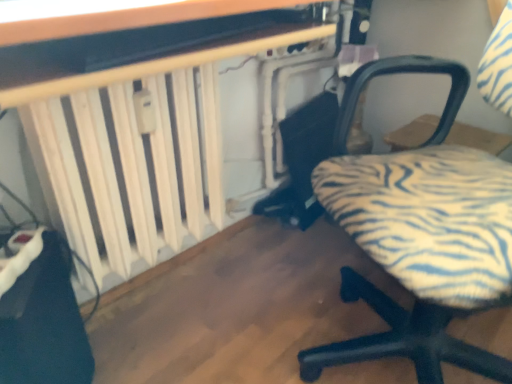
Question: Is zebra-patterned fabric chair at lower right at the left side of white wooden radiator at left, which is the first table in back-to-front order?

Choices:
 (A) no
 (B) yes

Answer: (A)

Question: Could you tell me if zebra-patterned fabric chair at lower right is turned towards white wooden radiator at left, which is the first table in back-to-front order?

Choices:
 (A) yes
 (B) no

Answer: (B)

Question: From a real-world perspective, is zebra-patterned fabric chair at lower right under white wooden radiator at left, which is the first table in back-to-front order?

Choices:
 (A) no
 (B) yes

Answer: (A)

Question: Is zebra-patterned fabric chair at lower right far away from white wooden radiator at left, which is the first table in back-to-front order?

Choices:
 (A) yes
 (B) no

Answer: (B)

Question: Considering the relative positions of zebra-patterned fabric chair at lower right and white wooden radiator at left, which is the first table in back-to-front order, in the image provided, is zebra-patterned fabric chair at lower right to the right of white wooden radiator at left, which is the first table in back-to-front order, from the viewer's perspective?

Choices:
 (A) yes
 (B) no

Answer: (A)

Question: Is white wooden radiator at left, which is the 2th table in front-to-back order, in front of or behind wooden table at upper center, which is the 2th table from back to front, in the image?

Choices:
 (A) behind
 (B) front

Answer: (A)

Question: Is white wooden radiator at left, which is the first table in back-to-front order, wider or thinner than wooden table at upper center, arranged as the first table when viewed from the front?

Choices:
 (A) thin
 (B) wide

Answer: (B)

Question: From a real-world perspective, is white wooden radiator at left, which is the first table in back-to-front order, above or below wooden table at upper center, arranged as the first table when viewed from the front?

Choices:
 (A) above
 (B) below

Answer: (B)

Question: Considering the positions of white wooden radiator at left, which is the first table in back-to-front order, and wooden table at upper center, which is the 2th table from back to front, in the image, is white wooden radiator at left, which is the first table in back-to-front order, taller or shorter than wooden table at upper center, which is the 2th table from back to front,?

Choices:
 (A) short
 (B) tall

Answer: (B)

Question: Would you say wooden table at upper center, arranged as the first table when viewed from the front, is inside or outside white wooden radiator at left, which is the first table in back-to-front order?

Choices:
 (A) outside
 (B) inside

Answer: (A)

Question: Considering the positions of wooden table at upper center, arranged as the first table when viewed from the front, and white wooden radiator at left, which is the first table in back-to-front order, in the image, is wooden table at upper center, arranged as the first table when viewed from the front, wider or thinner than white wooden radiator at left, which is the first table in back-to-front order,?

Choices:
 (A) thin
 (B) wide

Answer: (A)

Question: In terms of height, does wooden table at upper center, which is the 2th table from back to front, look taller or shorter compared to white wooden radiator at left, which is the first table in back-to-front order?

Choices:
 (A) short
 (B) tall

Answer: (A)

Question: Looking at the image, does wooden table at upper center, which is the 2th table from back to front, seem bigger or smaller compared to white wooden radiator at left, which is the 2th table in front-to-back order?

Choices:
 (A) small
 (B) big

Answer: (A)

Question: Would you say zebra-patterned fabric chair at lower right is to the left or to the right of white wooden radiator at left, which is the first table in back-to-front order, in the picture?

Choices:
 (A) right
 (B) left

Answer: (A)

Question: From the image's perspective, is zebra-patterned fabric chair at lower right above or below white wooden radiator at left, which is the 2th table in front-to-back order?

Choices:
 (A) below
 (B) above

Answer: (A)